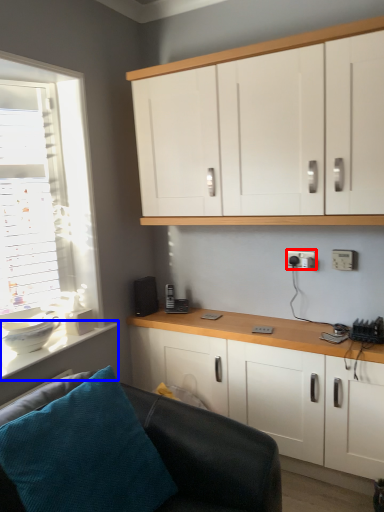
Question: Which object appears closest to the camera in this image, electric outlet (highlighted by a red box) or counter top (highlighted by a blue box)?

Choices:
 (A) electric outlet
 (B) counter top

Answer: (B)